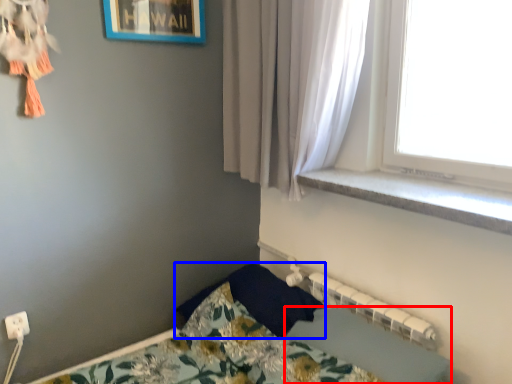
Question: Which of the following is the closest to the observer, sheet (highlighted by a red box) or pillow (highlighted by a blue box)?

Choices:
 (A) sheet
 (B) pillow

Answer: (A)